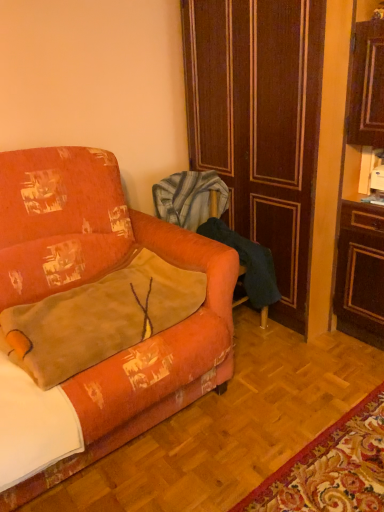
Image resolution: width=384 pixels, height=512 pixels. Identify the location of brown wood door at center. (260, 124).

The width and height of the screenshot is (384, 512). What do you see at coordinates (216, 227) in the screenshot? I see `velvet orange armchair at center` at bounding box center [216, 227].

I want to click on velvet orange armchair at center, so click(216, 227).

The width and height of the screenshot is (384, 512). What are the coordinates of `orange fabric couch at left` in the screenshot? It's located at tap(96, 317).

Identify the location of brown wood door at center. (260, 124).

From the image's perspective, is velvet orange throw pillow at lower left on brown wood door at center?

Incorrect, from the image's perspective, velvet orange throw pillow at lower left is lower than brown wood door at center.

In terms of width, does velvet orange throw pillow at lower left look wider or thinner when compared to brown wood door at center?

Clearly, velvet orange throw pillow at lower left has less width compared to brown wood door at center.

From a real-world perspective, is velvet orange throw pillow at lower left above or below brown wood door at center?

In terms of real-world spatial position, velvet orange throw pillow at lower left is below brown wood door at center.

From the picture: Is velvet orange throw pillow at lower left behind brown wood door at center?

No, velvet orange throw pillow at lower left is closer to the viewer.

From the picture: From a real-world perspective, is velvet orange armchair at center on velvet orange throw pillow at lower left?

Actually, velvet orange armchair at center is physically below velvet orange throw pillow at lower left in the real world.

Is the position of velvet orange armchair at center more distant than that of velvet orange throw pillow at lower left?

Yes, it is behind velvet orange throw pillow at lower left.

Where is `throw pillow in front of the velvet orange armchair at center`? The height and width of the screenshot is (512, 384). throw pillow in front of the velvet orange armchair at center is located at coordinates (100, 317).

Can you confirm if velvet orange armchair at center is thinner than velvet orange throw pillow at lower left?

Yes.

What are the coordinates of `door located above the velvet orange armchair at center (from the image's perspective)` in the screenshot? It's located at (260, 124).

Based on the photo, which of these two, velvet orange armchair at center or brown wood door at center, is thinner?

Thinner between the two is velvet orange armchair at center.

How many degrees apart are the facing directions of velvet orange armchair at center and brown wood door at center?

There is a 90-degree angle between the facing directions of velvet orange armchair at center and brown wood door at center.

Is velvet orange armchair at center next to brown wood door at center?

No, velvet orange armchair at center is not making contact with brown wood door at center.

Considering the positions of objects brown wood door at center and orange fabric couch at left in the image provided, who is more to the left, brown wood door at center or orange fabric couch at left?

Positioned to the left is orange fabric couch at left.

Is brown wood door at center smaller than orange fabric couch at left?

Correct, brown wood door at center occupies less space than orange fabric couch at left.

From a real-world perspective, is brown wood door at center on orange fabric couch at left?

Yes, from a real-world perspective, brown wood door at center is above orange fabric couch at left.

Considering the relative sizes of velvet orange throw pillow at lower left and velvet orange armchair at center in the image provided, is velvet orange throw pillow at lower left taller than velvet orange armchair at center?

Incorrect, the height of velvet orange throw pillow at lower left is not larger of that of velvet orange armchair at center.

Looking at this image, measure the distance between velvet orange throw pillow at lower left and velvet orange armchair at center.

velvet orange throw pillow at lower left and velvet orange armchair at center are 25.54 inches apart from each other.

Could you tell me if velvet orange throw pillow at lower left is turned towards velvet orange armchair at center?

No, velvet orange throw pillow at lower left is not oriented towards velvet orange armchair at center.

Which is behind, point (161, 298) or point (267, 276)?

Positioned behind is point (267, 276).

Is orange fabric couch at left directly adjacent to velvet orange armchair at center?

No, orange fabric couch at left is not touching velvet orange armchair at center.

Based on the photo, would you say orange fabric couch at left is inside or outside velvet orange armchair at center?

The correct answer is: outside.

Looking at this image, considering the sizes of objects orange fabric couch at left and velvet orange armchair at center in the image provided, who is shorter, orange fabric couch at left or velvet orange armchair at center?

Standing shorter between the two is velvet orange armchair at center.

Is orange fabric couch at left at the left side of velvet orange armchair at center?

Indeed, orange fabric couch at left is positioned on the left side of velvet orange armchair at center.

Considering the sizes of objects orange fabric couch at left and brown wood door at center in the image provided, who is wider, orange fabric couch at left or brown wood door at center?

orange fabric couch at left.

Considering the relative sizes of orange fabric couch at left and brown wood door at center in the image provided, is orange fabric couch at left taller than brown wood door at center?

No, orange fabric couch at left is not taller than brown wood door at center.

Is orange fabric couch at left in front of brown wood door at center?

That is True.

In the scene shown: From a real-world perspective, is orange fabric couch at left physically located above or below brown wood door at center?

In terms of real-world spatial position, orange fabric couch at left is below brown wood door at center.

The width and height of the screenshot is (384, 512). In order to click on throw pillow that is under the brown wood door at center (from a real-world perspective) in this screenshot , I will do `click(100, 317)`.

Image resolution: width=384 pixels, height=512 pixels. I want to click on throw pillow located above the velvet orange armchair at center (from a real-world perspective), so coord(100,317).

When comparing their distances from velvet orange armchair at center, does brown wood door at center or velvet orange throw pillow at lower left seem closer?

brown wood door at center lies closer to velvet orange armchair at center than the other object.

Based on their spatial positions, is velvet orange throw pillow at lower left or velvet orange armchair at center closer to brown wood door at center?

velvet orange armchair at center.

Considering their positions, is velvet orange armchair at center positioned further to velvet orange throw pillow at lower left than orange fabric couch at left?

Based on the image, velvet orange armchair at center appears to be further to velvet orange throw pillow at lower left.

Based on their spatial positions, is orange fabric couch at left or velvet orange throw pillow at lower left further from brown wood door at center?

The object further to brown wood door at center is velvet orange throw pillow at lower left.

Estimate the real-world distances between objects in this image. Which object is further from velvet orange armchair at center, orange fabric couch at left or velvet orange throw pillow at lower left?

Based on the image, velvet orange throw pillow at lower left appears to be further to velvet orange armchair at center.

Looking at the image, which one is located further to velvet orange throw pillow at lower left, orange fabric couch at left or velvet orange armchair at center?

velvet orange armchair at center is further to velvet orange throw pillow at lower left.

Looking at the image, which one is located closer to velvet orange throw pillow at lower left, orange fabric couch at left or brown wood door at center?

orange fabric couch at left lies closer to velvet orange throw pillow at lower left than the other object.

Estimate the real-world distances between objects in this image. Which object is further from orange fabric couch at left, velvet orange throw pillow at lower left or brown wood door at center?

Among the two, brown wood door at center is located further to orange fabric couch at left.

Where is `armchair between orange fabric couch at left and brown wood door at center from left to right`? armchair between orange fabric couch at left and brown wood door at center from left to right is located at coordinates (216, 227).

What are the coordinates of `throw pillow positioned between orange fabric couch at left and velvet orange armchair at center from near to far` in the screenshot? It's located at (100, 317).

Locate an element on the screen. This screenshot has width=384, height=512. throw pillow situated between orange fabric couch at left and brown wood door at center from left to right is located at coordinates (100, 317).

Find the location of a particular element. This screenshot has height=512, width=384. armchair situated between velvet orange throw pillow at lower left and brown wood door at center from left to right is located at coordinates (216, 227).